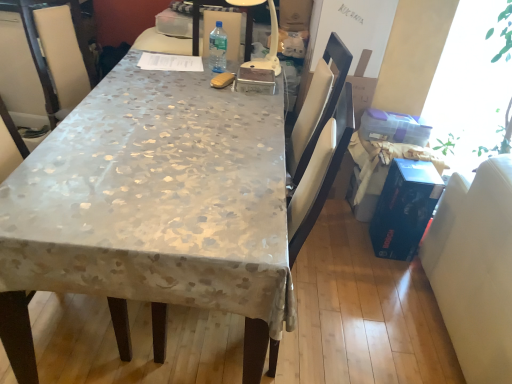
Question: Considering the positions of clear plastic bottle at center and white leather swivel chair at right in the image, is clear plastic bottle at center taller or shorter than white leather swivel chair at right?

Choices:
 (A) tall
 (B) short

Answer: (B)

Question: Considering the positions of point (224, 43) and point (488, 259), is point (224, 43) closer or farther from the camera than point (488, 259)?

Choices:
 (A) farther
 (B) closer

Answer: (A)

Question: Based on their relative distances, which object is farther from the clear plastic bottle at center?

Choices:
 (A) white plastic lamp at center
 (B) silky beige tablecloth at center
 (C) blue cardboard box at right
 (D) white leather swivel chair at right

Answer: (D)

Question: Which is nearer to the white plastic lamp at center?

Choices:
 (A) blue cardboard box at right
 (B) silky beige tablecloth at center
 (C) clear plastic bottle at center
 (D) white leather swivel chair at right

Answer: (C)